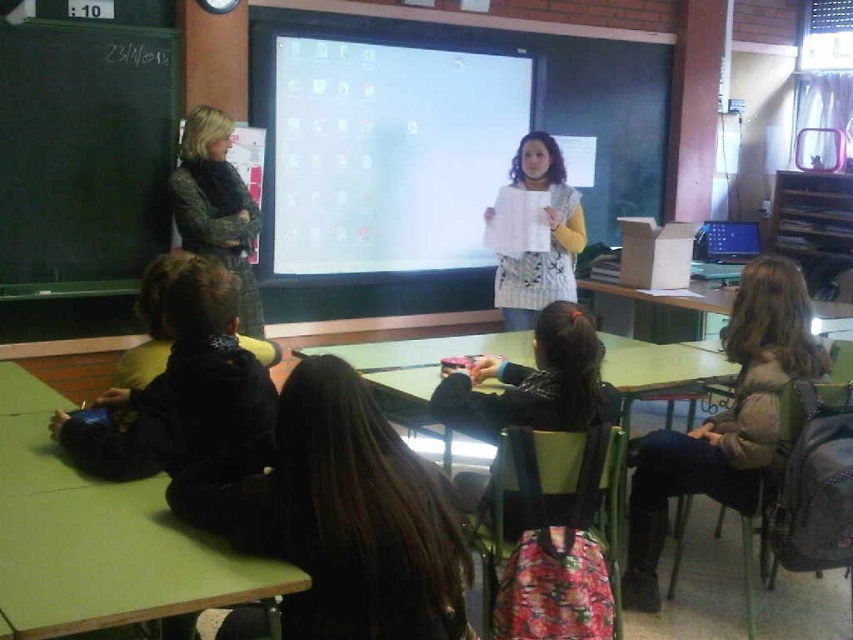
You are a teacher in the classroom. You need to walk from the black matte jacket at center to the light brown woolen sweater at lower right. Can you walk directly between them without needing to move any objects?

The black matte jacket at center and light brown woolen sweater at lower right are 1.39 meters apart, so yes, you can walk directly between them without needing to move any objects since the distance is sufficient for a person to pass through.

Based on the photo, you are a student in the classroom. You notice two adults wearing different clothing items. The black matte jacket at center and the light brown woolen sweater at lower right. Which clothing item is shorter in height?

The black matte jacket at center has a lesser height compared to the light brown woolen sweater at lower right, so the black matte jacket at center is shorter in height.